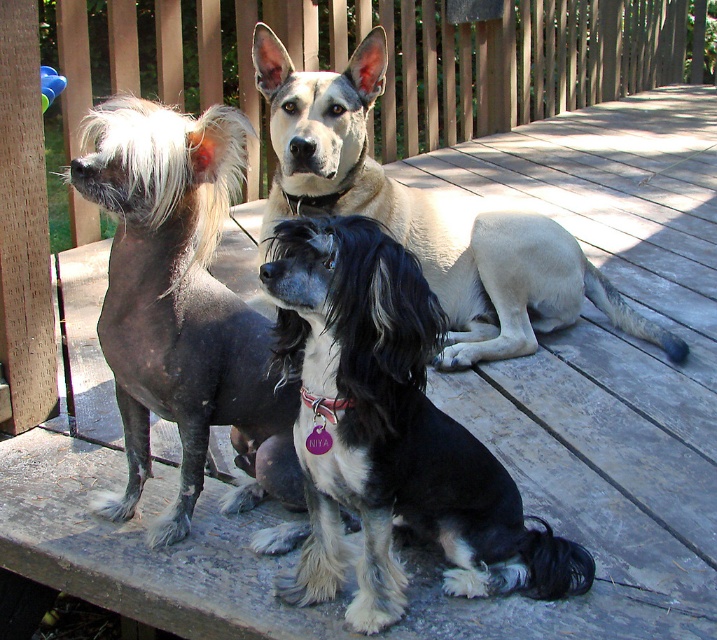
You are a dog owner who wants to ensure your pets have enough space on the deck. The black silky dog at center and the shiny black fur at center are both present. Which dog is shorter in height?

The black silky dog at center is shorter in height compared to the shiny black fur at center.